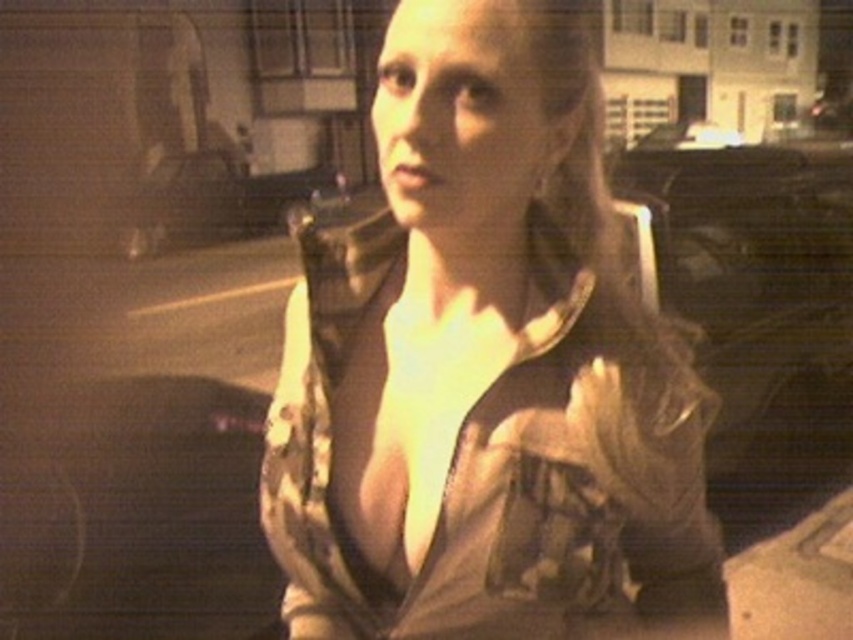
You are a delivery person trying to determine if the camo fabric jacket at center can fit into a box that is the same width as the metallic silver car at center. Can it fit?

The camo fabric jacket at center is thinner than the metallic silver car at center, so it can fit into a box with the same width as the metallic silver car at center.

You are a photographer trying to capture the scene. You notice the camo fabric jacket at center and the metallic silver car at center. Based on their positions, which object is closer to the right edge of the image?

The camo fabric jacket at center is to the right of the metallic silver car at center, so the camo fabric jacket at center is closer to the right edge of the image.

What is the object located at the coordinates point (486, 369) in the image?

The point (486, 369) corresponds to the camo fabric jacket at center.